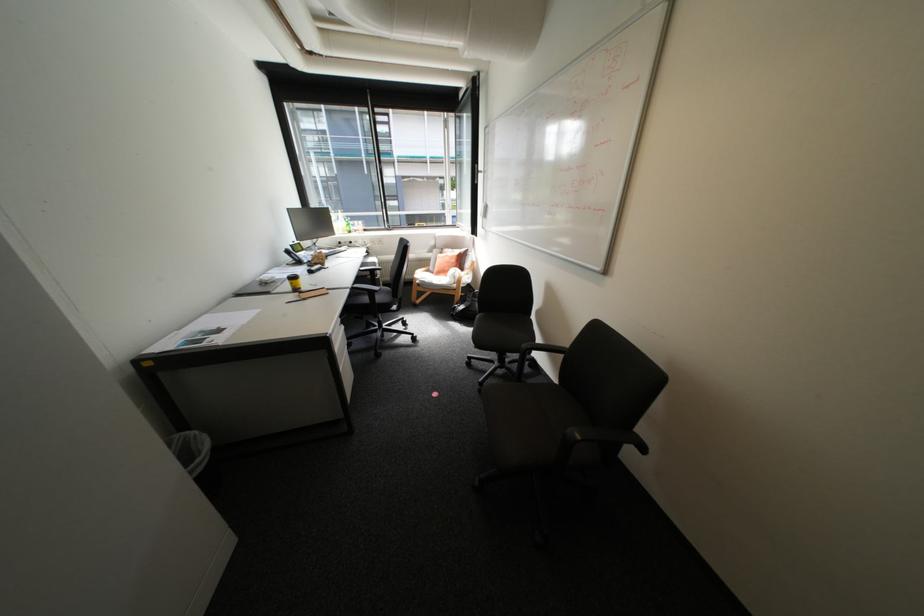
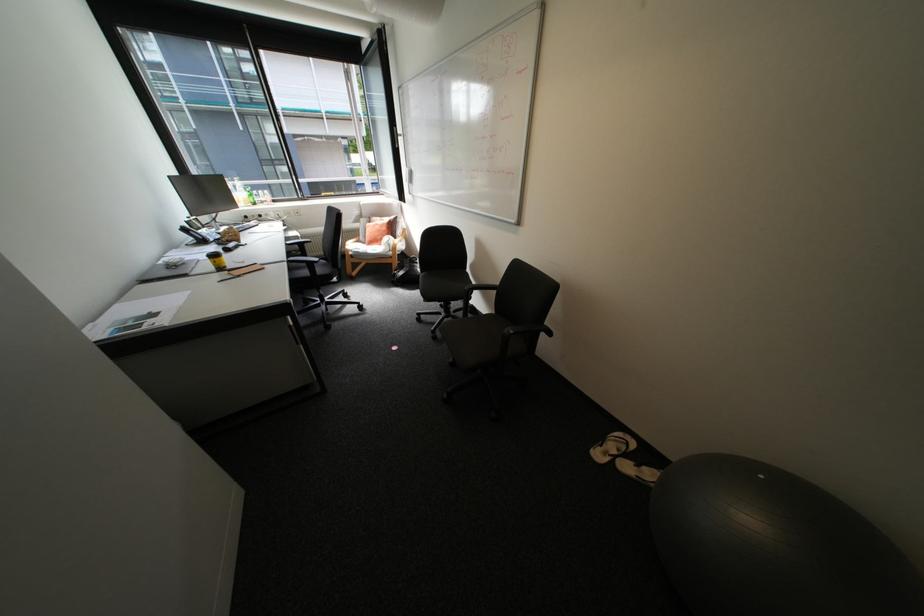
In the second image, find the point that corresponds to the point at 359,286 in the first image.

(295, 259)